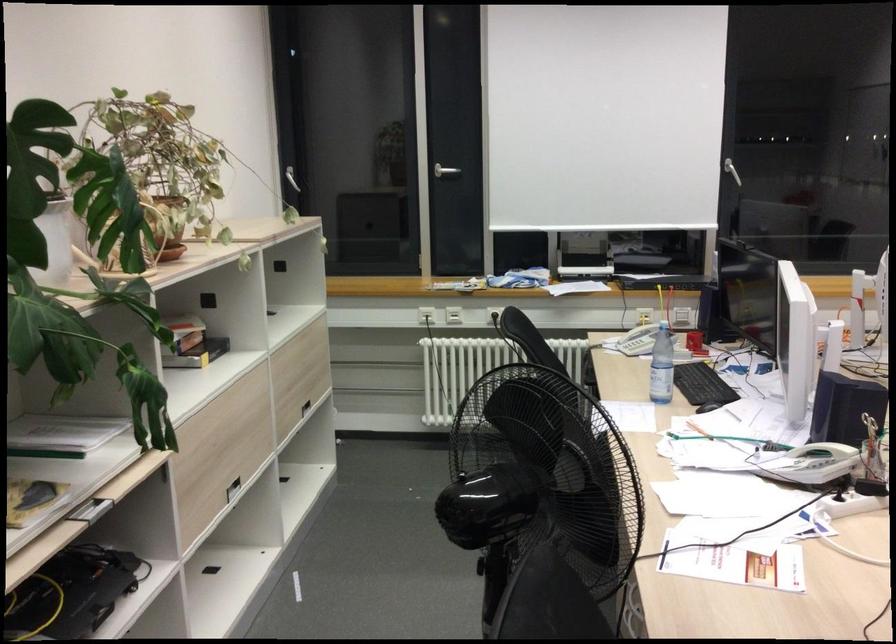
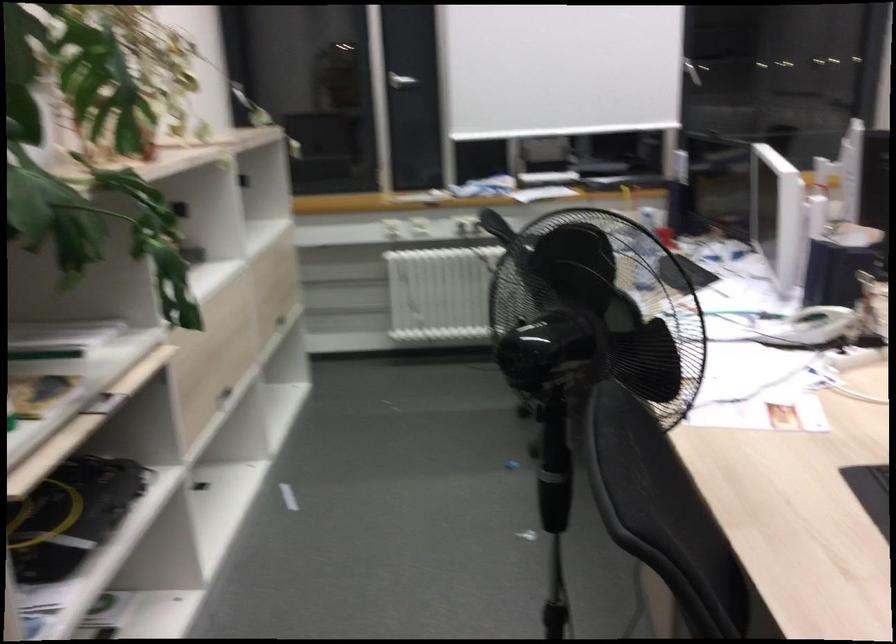
The point at (213, 491) is marked in the first image. Where is the corresponding point in the second image?

(211, 395)